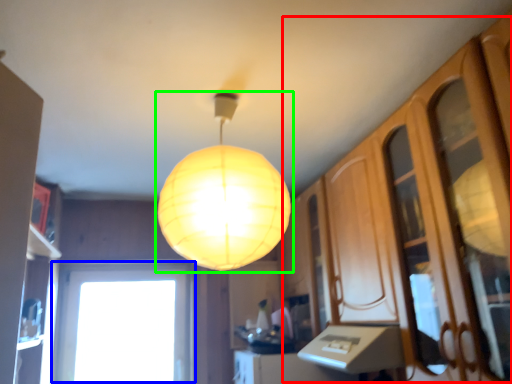
Question: Which object is positioned farthest from dresser (highlighted by a red box)? Select from window (highlighted by a blue box) and lamp (highlighted by a green box).

Choices:
 (A) window
 (B) lamp

Answer: (A)